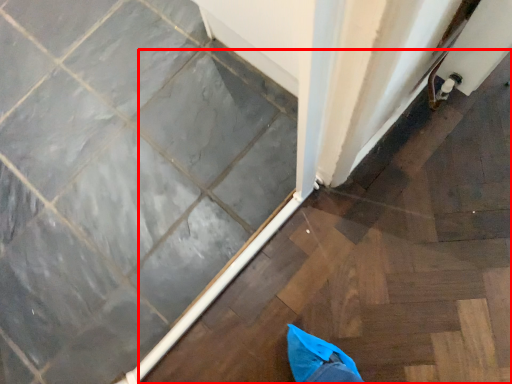
Question: From the image's perspective, where is stairwell (annotated by the red box) located relative to ceramic tile?

Choices:
 (A) below
 (B) above

Answer: (A)